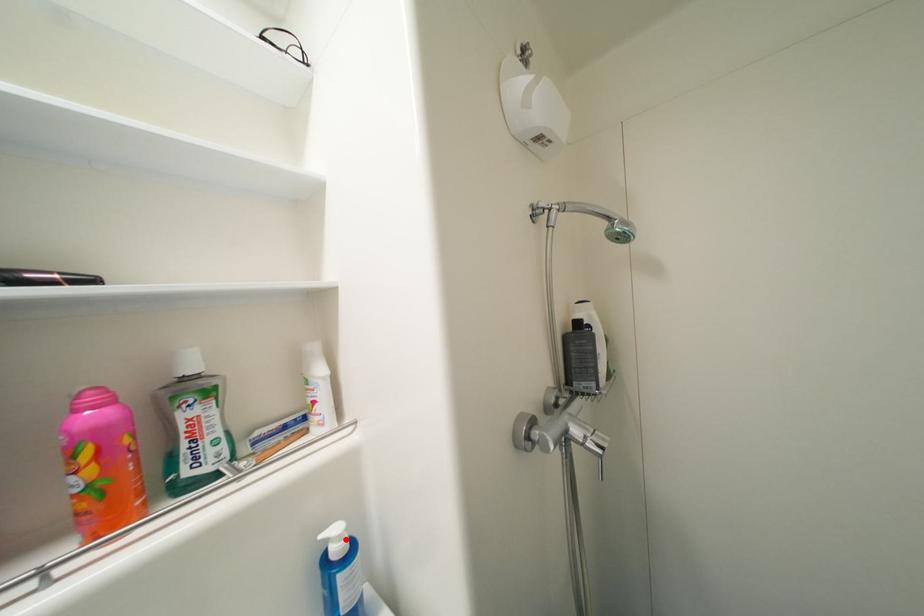
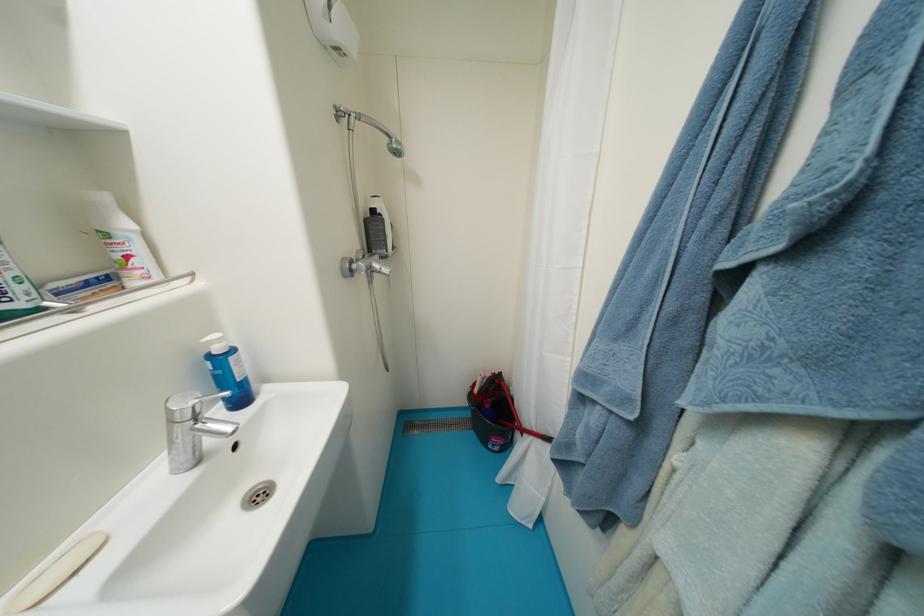
Find the pixel in the second image that matches the highlighted location in the first image.

(225, 342)